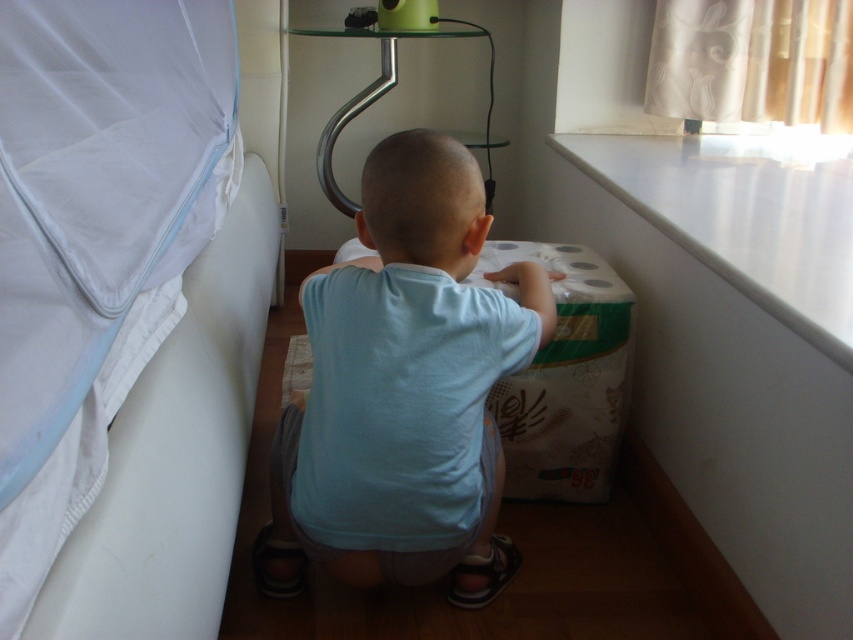
You are standing in the room and want to reach the window where the box is placed. The white fabric bed at left is in your way. Can you walk around it to get to the window?

The white fabric bed at left is 21.29 inches from viewer, so yes, you can walk around it to reach the window since it is close enough to maneuver around.

Based on the coordinates provided, which object is located at point (96,236)?

The white fabric bed at left is located at point (96,236).

In the scene, there is a white fabric bed at left. Where exactly is it located in terms of coordinates?

The white fabric bed at left is located at point (96, 236).